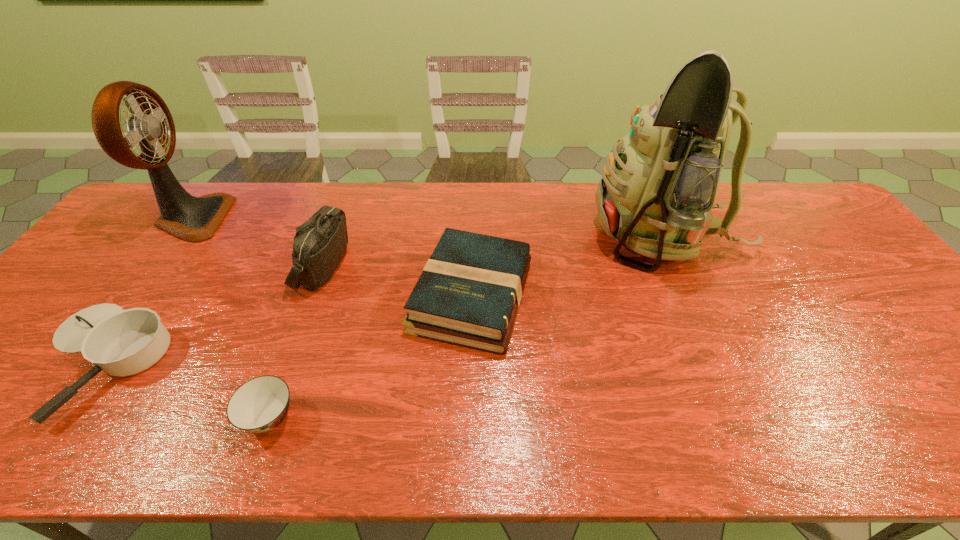
You are a GUI agent. You are given a task and a screenshot of the screen. Output one action in this format:
    pyautogui.click(x=<x>, y=<y>)
    Task: Click on the object that ranks as the second closest to the shoulder bag
    
    Given the screenshot: What is the action you would take?
    pyautogui.click(x=119, y=342)

Locate an element on the screen. The image size is (960, 540). vacant space that satisfies the following two spatial constraints: 1. at the front padded panel of the shoulder bag; 2. on the right side of the hardback book is located at coordinates (312, 296).

The height and width of the screenshot is (540, 960). Identify the location of vacant space that satisfies the following two spatial constraints: 1. on the back side of the soup bowl; 2. on the left side of the fourth tallest object. (312, 296).

This screenshot has width=960, height=540. What are the coordinates of `vacant region that satisfies the following two spatial constraints: 1. on the back side of the second object from right to left; 2. on the front-facing side of the second tallest object` in the screenshot? It's located at (473, 218).